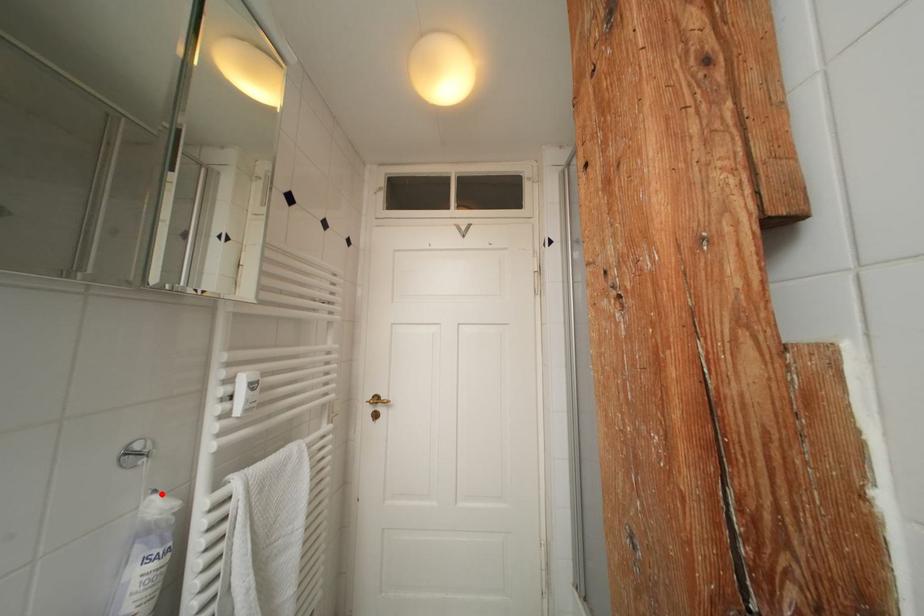
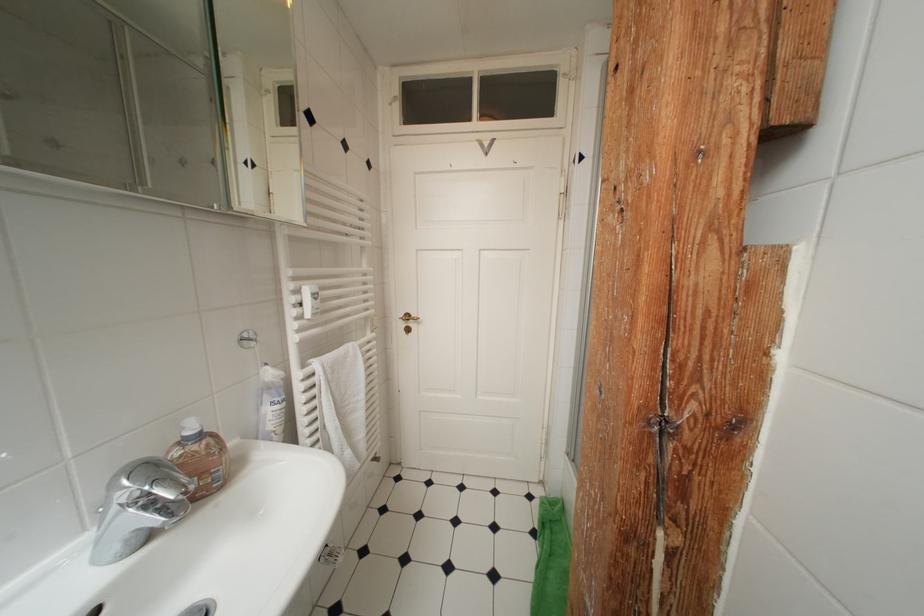
In the second image, find the point that corresponds to the highlighted location in the first image.

(274, 368)